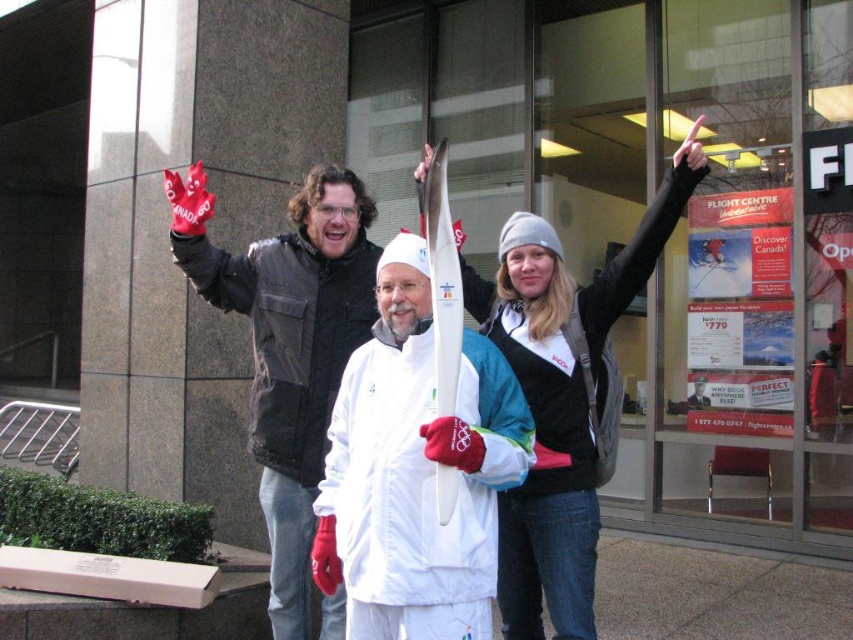
You are an event organizer setting up a photo shoot for a winter sports event. You have a white matte ski at center and a white woolen hat at upper center in the scene. Which object is narrower in width?

The white matte ski at center is narrower in width compared to the white woolen hat at upper center.

What is the object located at the coordinates point (416, 470) in the scene?

The object located at point (416, 470) is the white matte ski at center.